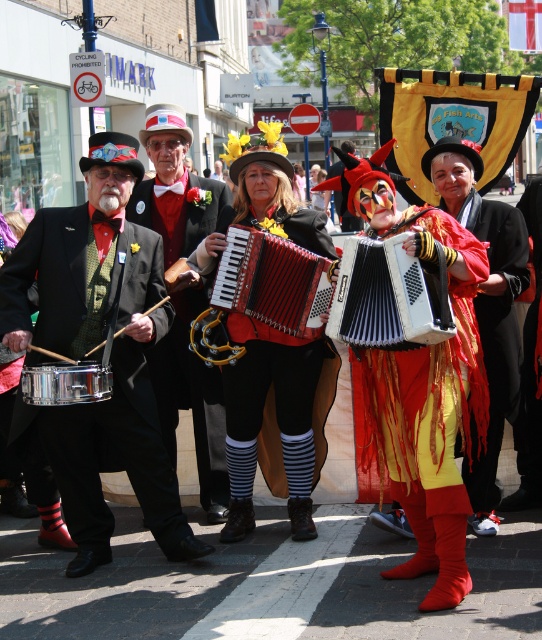
You are a photographer aiming to capture the shiny black drum at left and the white plastic accordion at center in your shot. Which object should you focus on first if you want to ensure both are in sharp focus?

You should focus on the shiny black drum at left first because it is closer to the viewer than the white plastic accordion at center. By focusing on the closer object, the accordion will also be in focus due to the depth of field extending beyond it.

You are a street performer who wants to place your shiny black drum at left and white plastic accordion at center into a storage case. The case has two compartments. The upper compartment is smaller than the lower compartment. Which object should go into the upper compartment?

The shiny black drum at left should go into the lower compartment because it is below the white plastic accordion at center, indicating it might be larger. The white plastic accordion at center should go into the upper compartment since it is positioned higher and possibly smaller.

You are a street performer who wants to carry both the shiny black drum at left and the white plastic accordion at center. Since you can only carry one item at a time, which one should you pick up first if you want to reach the taller object first?

The shiny black drum at left is much taller than the white plastic accordion at center, so you should pick up the shiny black drum at left first to reach the taller object first.